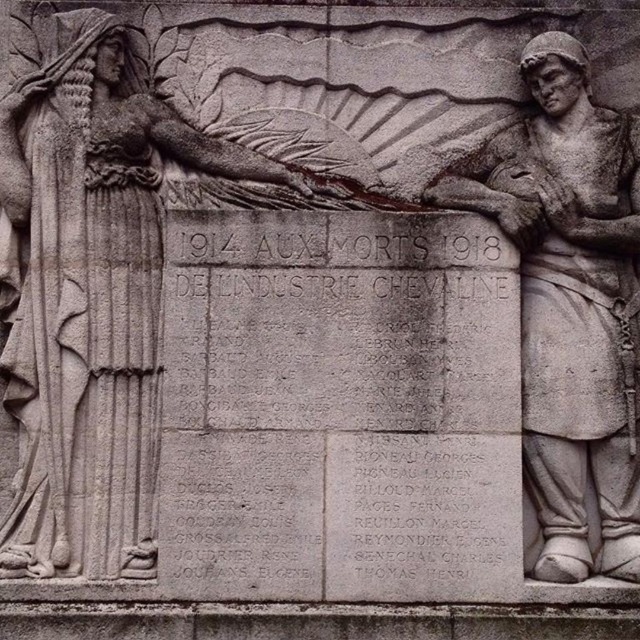
Question: Which point is closer to the camera?

Choices:
 (A) gray stone statue at left
 (B) gray stone soldier at right

Answer: (B)

Question: Which object appears farthest from the camera in this image?

Choices:
 (A) gray stone soldier at right
 (B) gray stone statue at left

Answer: (B)

Question: Can you confirm if gray stone statue at left is wider than gray stone soldier at right?

Choices:
 (A) yes
 (B) no

Answer: (A)

Question: Is gray stone statue at left to the left of gray stone soldier at right from the viewer's perspective?

Choices:
 (A) yes
 (B) no

Answer: (A)

Question: Is gray stone statue at left thinner than gray stone soldier at right?

Choices:
 (A) no
 (B) yes

Answer: (A)